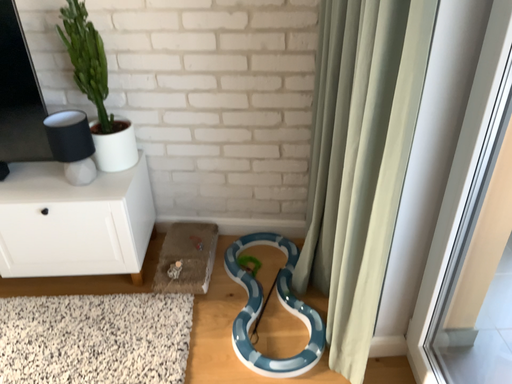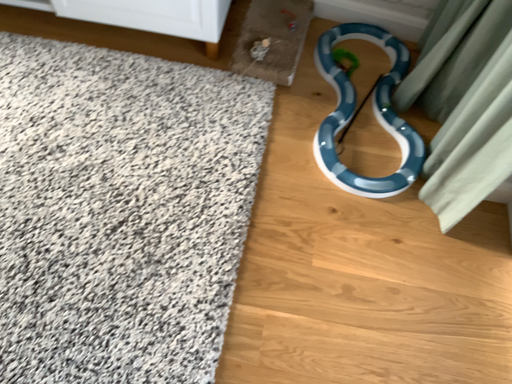
Question: Which way did the camera rotate in the video?

Choices:
 (A) rotated upward
 (B) rotated downward

Answer: (B)